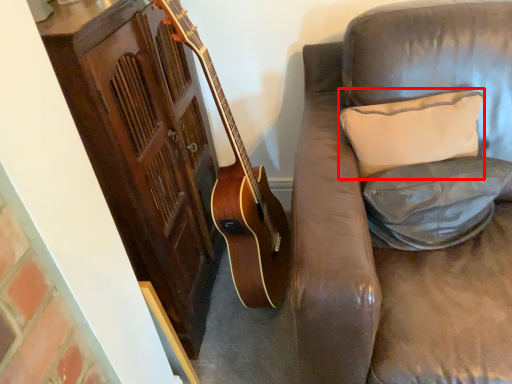
Question: Where is pillow (annotated by the red box) located in relation to pillow in the image?

Choices:
 (A) left
 (B) right

Answer: (A)